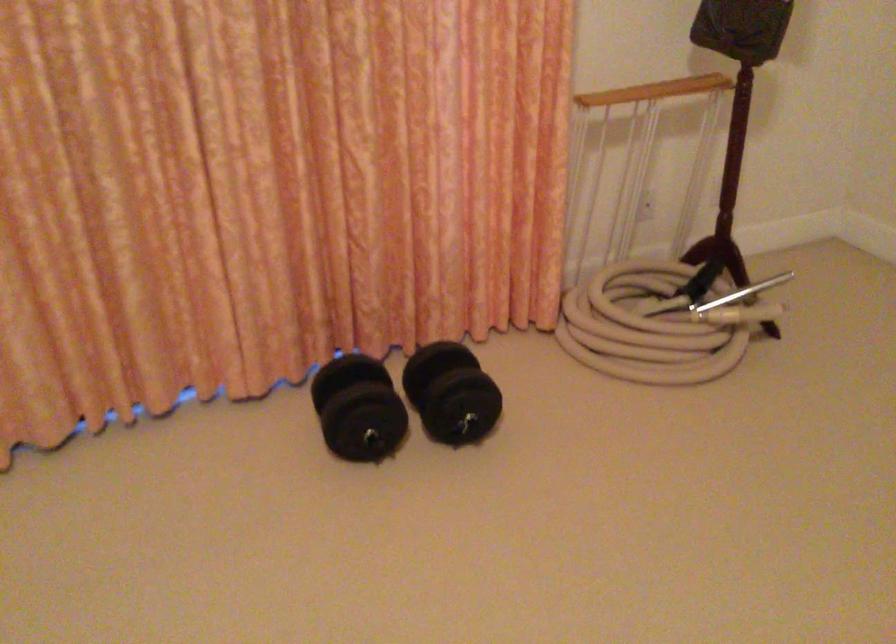
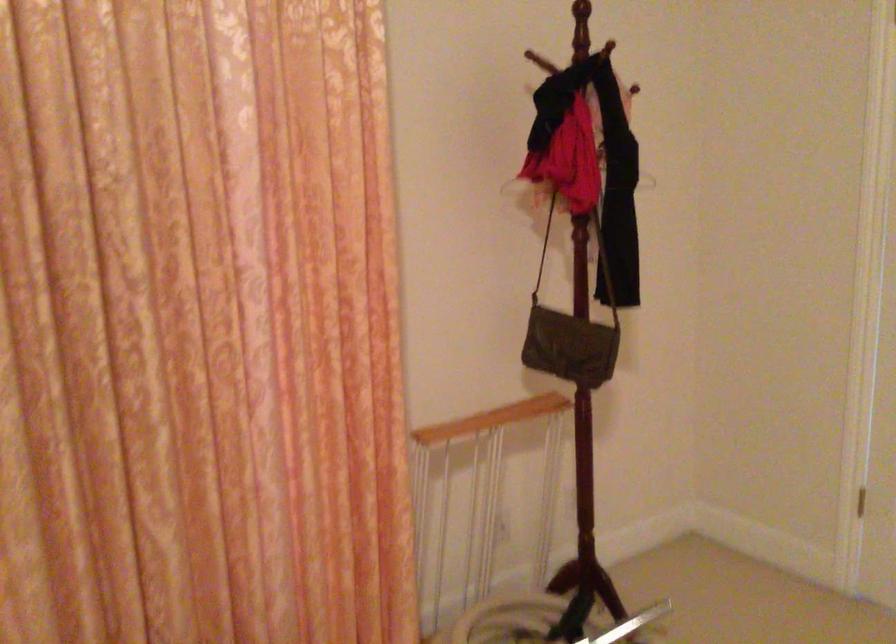
Question: The images are taken continuously from a first-person perspective. In which direction are you moving?

Choices:
 (A) Left
 (B) Right
 (C) Forward
 (D) Backward

Answer: (C)